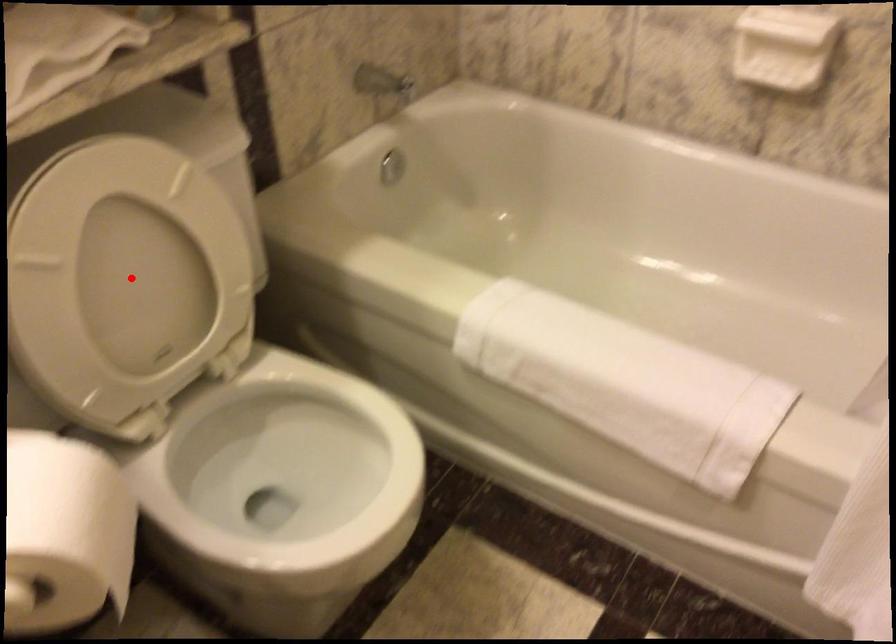
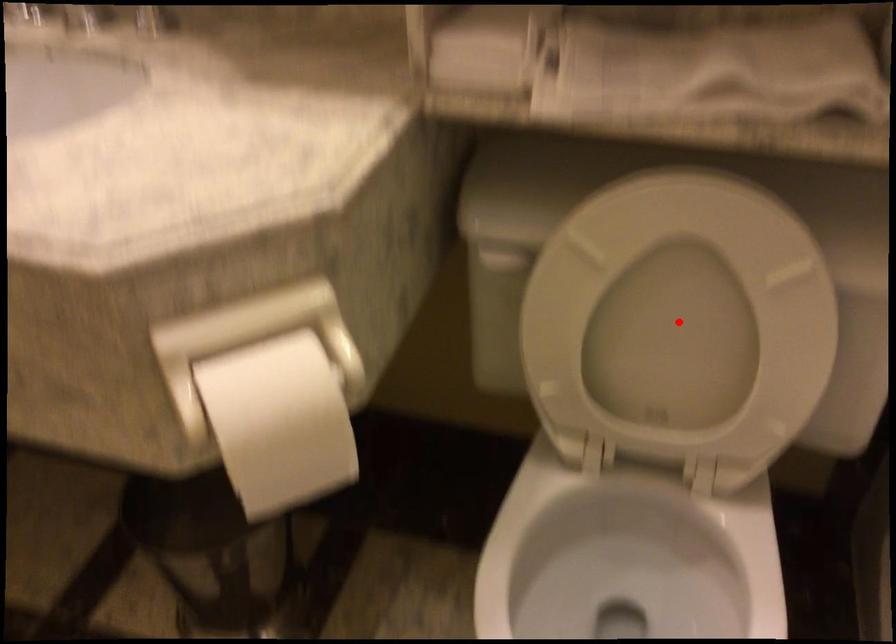
I am providing you with two images of the same scene from different viewpoints. A red point is marked on the first image and another point is marked on the second image. Is the marked point in image1 the same physical position as the marked point in image2?

Yes